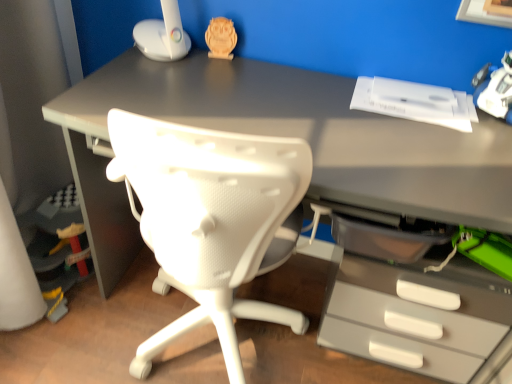
Where is `free space in front of wooden owl at upper center, which is counted as the second toy, starting from the right`? This screenshot has width=512, height=384. free space in front of wooden owl at upper center, which is counted as the second toy, starting from the right is located at coordinates (230, 76).